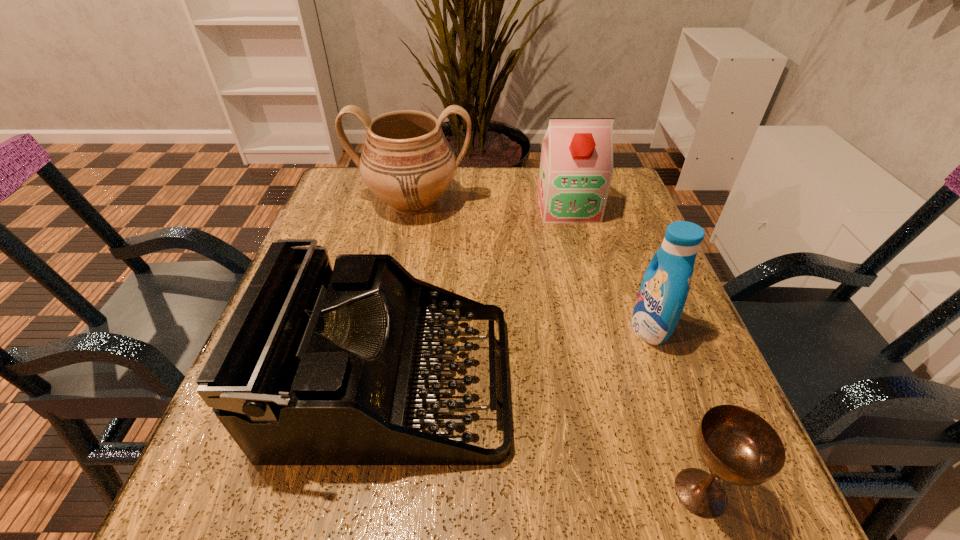
This screenshot has height=540, width=960. Identify the location of chalice that is at the right edge. (737, 445).

Find the location of a particular element. object that is positioned at the far left corner is located at coordinates (407, 162).

Locate an element on the screen. The width and height of the screenshot is (960, 540). object that is at the near left corner is located at coordinates (316, 366).

At what (x,y) coordinates should I click in order to perform the action: click on object situated at the far right corner. Please return your answer as a coordinate pair (x, y). The width and height of the screenshot is (960, 540). Looking at the image, I should click on (576, 167).

The image size is (960, 540). I want to click on object that is at the near right corner, so click(x=737, y=445).

The image size is (960, 540). In the image, there is a desktop. What are the coordinates of `vacant space at the far edge` in the screenshot? It's located at click(x=512, y=218).

Find the location of a particular element. This screenshot has height=540, width=960. free spot at the left edge of the desktop is located at coordinates (352, 224).

I want to click on vacant region at the right edge of the desktop, so click(615, 242).

You are a GUI agent. You are given a task and a screenshot of the screen. Output one action in this format:
    pyautogui.click(x=<x>, y=<y>)
    Task: Click on the vacant region at the far left corner of the desktop
    
    Given the screenshot: What is the action you would take?
    pyautogui.click(x=374, y=212)

In order to click on free space at the near left corner of the desktop in this screenshot , I will do `click(271, 483)`.